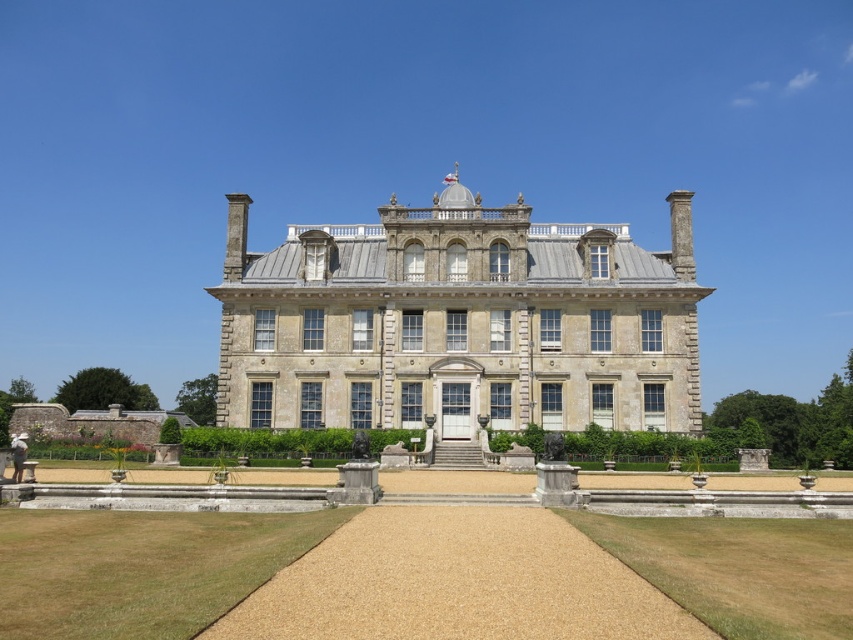
You are standing at the entrance of the historic building and want to walk to the green grass at lower right. Which direction should you head from the green grass at lower center?

The green grass at lower center is positioned on the left side of green grass at lower right, so you should head to the right from the green grass at lower center to reach the green grass at lower right.

You are a landscape architect planning to install a new garden feature between the stone mansion at center and the green grass at lower center. Considering their sizes, which area would be more appropriate for placing a large fountain?

The stone mansion at center is larger in size than the green grass at lower center, so the area near the stone mansion at center would be more appropriate for placing a large fountain due to its greater space availability.